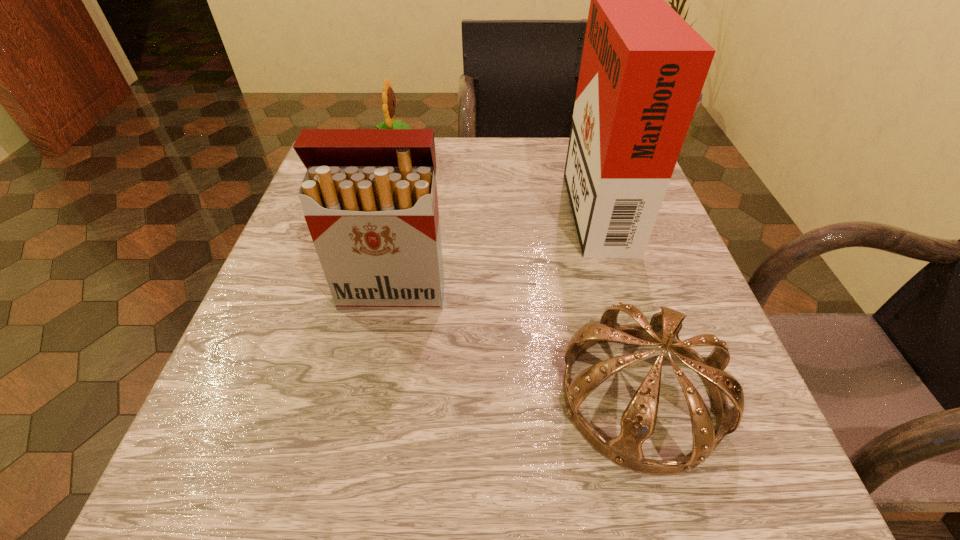
Find the location of `free space between the tiara and the sunflower`. free space between the tiara and the sunflower is located at coordinates (518, 275).

Where is `vacant point located between the farther cigarette case and the left cigarette case`? vacant point located between the farther cigarette case and the left cigarette case is located at coordinates (494, 247).

Identify the location of free space between the tallest object and the left cigarette case. The width and height of the screenshot is (960, 540). (494, 247).

What are the coordinates of `free space between the nearer cigarette case and the tiara` in the screenshot? It's located at (516, 345).

Image resolution: width=960 pixels, height=540 pixels. I want to click on free area in between the third shortest object and the right cigarette case, so click(x=494, y=247).

Select which object is the second closest to the second shortest object. Please provide its 2D coordinates. Your answer should be formatted as a tuple, i.e. [(x, y)], where the tuple contains the x and y coordinates of a point satisfying the conditions above.

[(369, 196)]

Select which object is the second closest to the taller cigarette case. Please provide its 2D coordinates. Your answer should be formatted as a tuple, i.e. [(x, y)], where the tuple contains the x and y coordinates of a point satisfying the conditions above.

[(369, 196)]

The image size is (960, 540). Identify the location of free location that satisfies the following two spatial constraints: 1. on the front-facing side of the farther cigarette case; 2. with the lid open on the left cigarette case. (623, 293).

Locate an element on the screen. This screenshot has width=960, height=540. free spot that satisfies the following two spatial constraints: 1. on the front-facing side of the right cigarette case; 2. with the lid open on the shorter cigarette case is located at coordinates (623, 293).

You are a GUI agent. You are given a task and a screenshot of the screen. Output one action in this format:
    pyautogui.click(x=<x>, y=<y>)
    Task: Click on the vacant space that satisfies the following two spatial constraints: 1. with the lid open on the shortest object; 2. on the right side of the shorter cigarette case
    The image size is (960, 540).
    Given the screenshot: What is the action you would take?
    pyautogui.click(x=373, y=396)